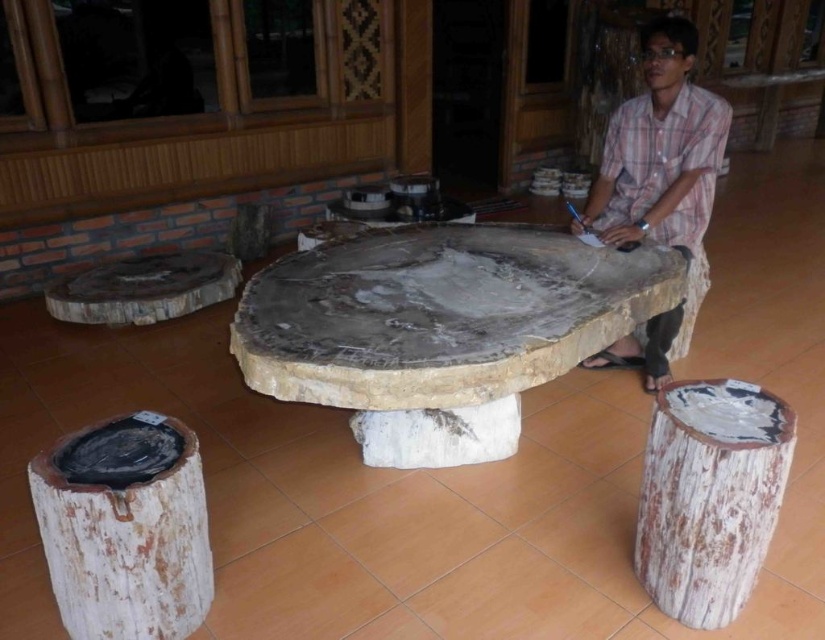
Is natural stone table at center bigger than plaid shirt at center?

Correct, natural stone table at center is larger in size than plaid shirt at center.

Is natural stone table at center thinner than plaid shirt at center?

In fact, natural stone table at center might be wider than plaid shirt at center.

Is point (258, 296) closer to camera compared to point (640, 166)?

Yes, point (258, 296) is closer to viewer.

The image size is (825, 640). I want to click on natural stone table at center, so click(439, 330).